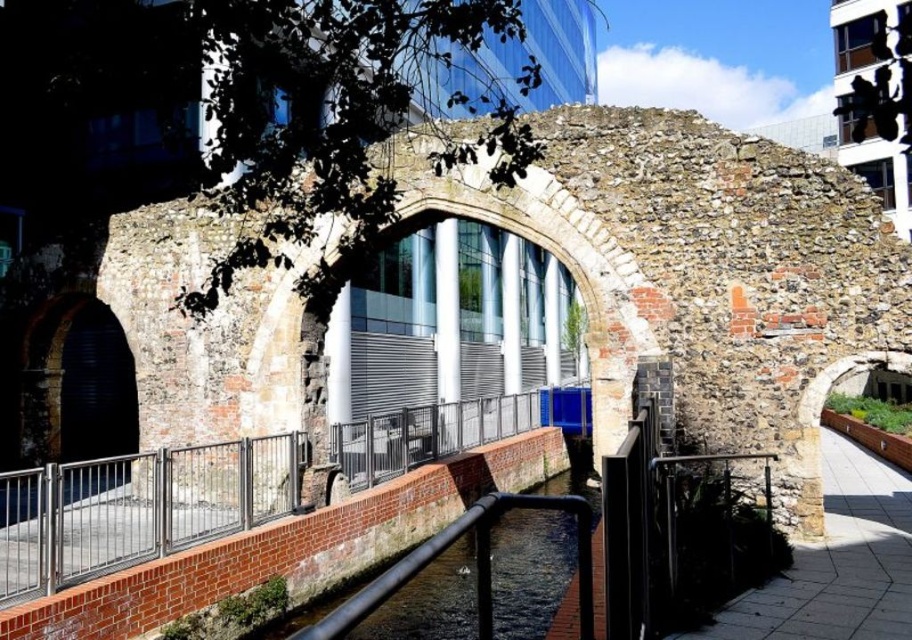
Question: Is stainless steel railing at lower center to the right of smooth stone path at lower right from the viewer's perspective?

Choices:
 (A) yes
 (B) no

Answer: (B)

Question: Can you confirm if stainless steel railing at lower center is positioned above smooth stone path at lower right?

Choices:
 (A) no
 (B) yes

Answer: (A)

Question: Which point is farther to the camera?

Choices:
 (A) smooth stone path at lower right
 (B) stainless steel railing at lower center

Answer: (B)

Question: Which object appears closest to the camera in this image?

Choices:
 (A) stainless steel railing at lower center
 (B) smooth stone path at lower right

Answer: (B)

Question: Among these points, which one is nearest to the camera?

Choices:
 (A) (815, 614)
 (B) (537, 412)

Answer: (A)

Question: Can you confirm if stainless steel railing at lower center is smaller than smooth stone path at lower right?

Choices:
 (A) no
 (B) yes

Answer: (A)